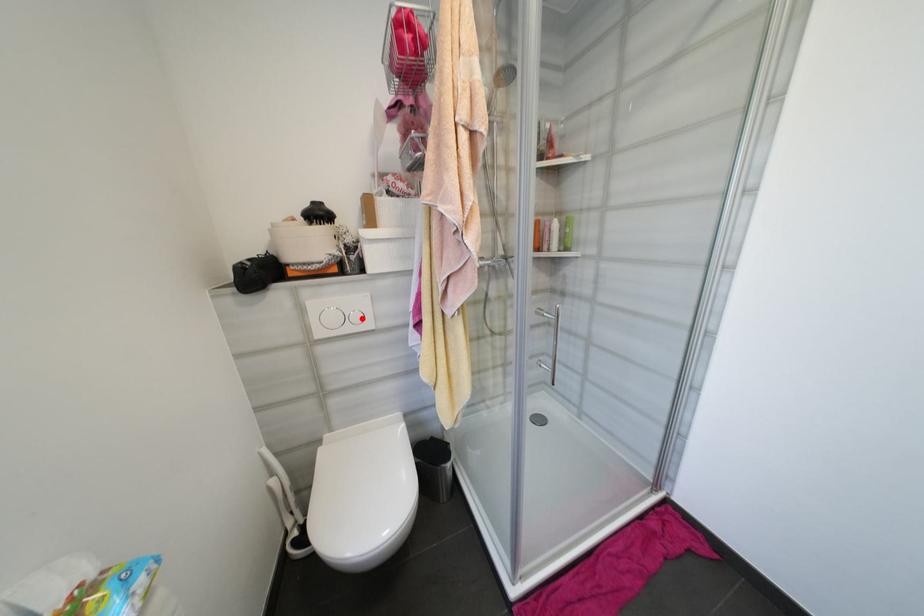
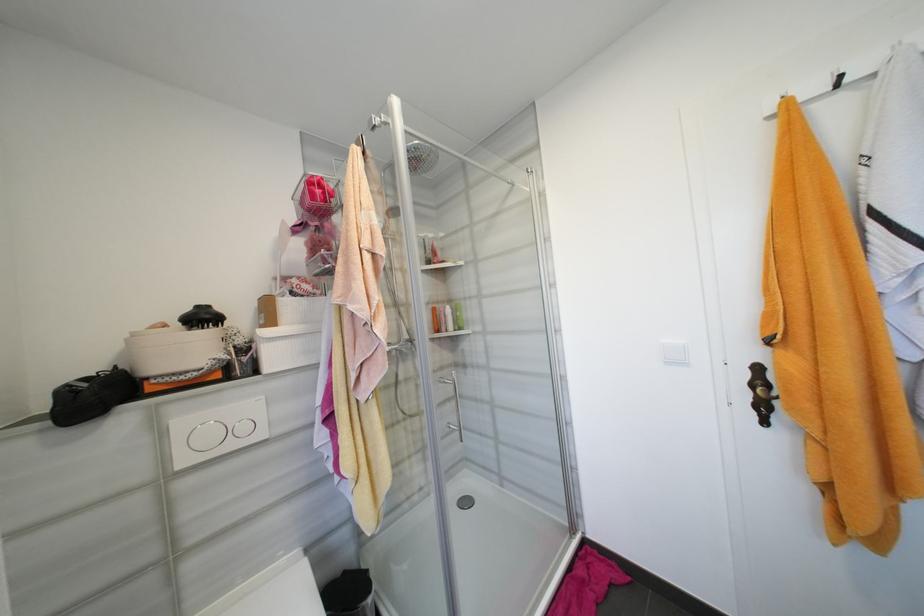
Where in the second image is the point corresponding to the highlighted location from the first image?

(249, 429)